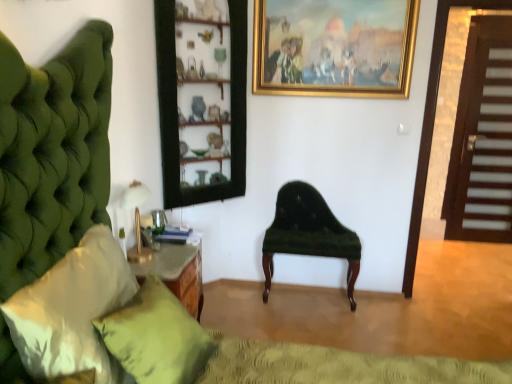
The width and height of the screenshot is (512, 384). Find the location of `vacant area that lies to the right of gold metallic table lamp at left`. vacant area that lies to the right of gold metallic table lamp at left is located at coordinates (175, 258).